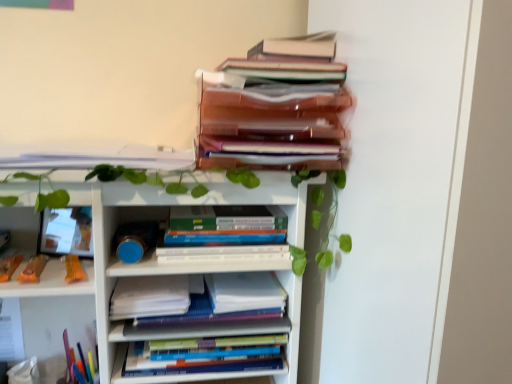
This screenshot has width=512, height=384. Find the location of `empty space that is ontop of hardcover books at center, the 3th book in the top-to-bottom sequence`. empty space that is ontop of hardcover books at center, the 3th book in the top-to-bottom sequence is located at coordinates (222, 215).